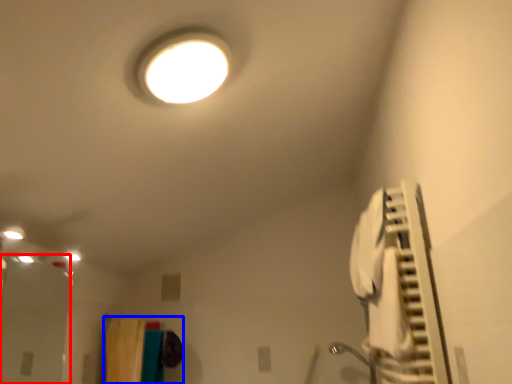
Question: Which object is closer to the camera taking this photo, glass door (highlighted by a red box) or laundry (highlighted by a blue box)?

Choices:
 (A) glass door
 (B) laundry

Answer: (A)